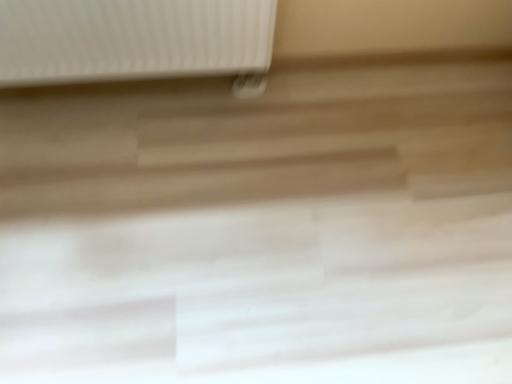
Locate an element on the screen. This screenshot has width=512, height=384. white ribbed radiator at upper left is located at coordinates (135, 41).

Describe the element at coordinates (135, 41) in the screenshot. The width and height of the screenshot is (512, 384). I see `white ribbed radiator at upper left` at that location.

Locate an element on the screen. white ribbed radiator at upper left is located at coordinates (135, 41).